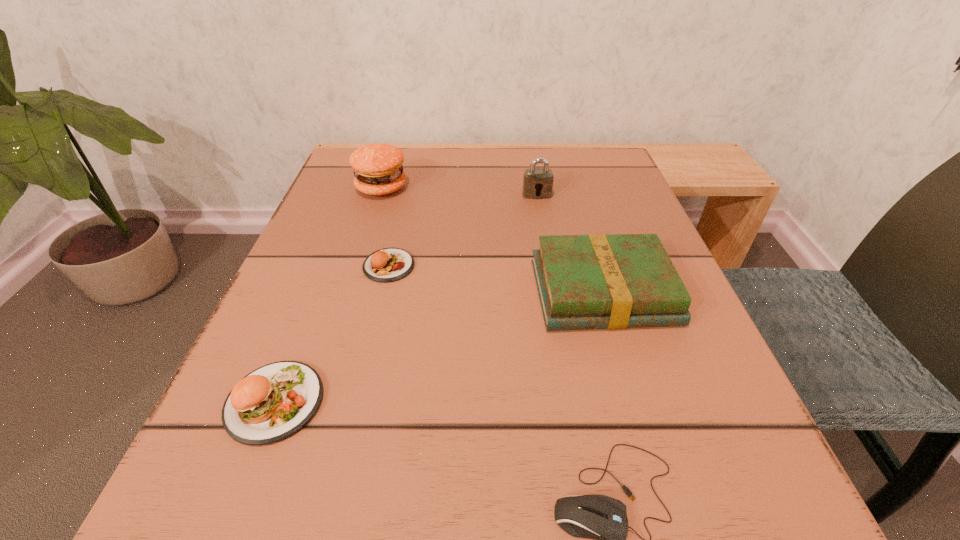
Where is `the farthest patty (food)`? Image resolution: width=960 pixels, height=540 pixels. the farthest patty (food) is located at coordinates (378, 170).

This screenshot has width=960, height=540. In order to click on padlock in this screenshot , I will do `click(536, 181)`.

Identify the location of the fourth shortest object. The height and width of the screenshot is (540, 960). (596, 281).

Find the location of a particular element. The height and width of the screenshot is (540, 960). the fourth tallest object is located at coordinates (271, 403).

You are a GUI agent. You are given a task and a screenshot of the screen. Output one action in this format:
    pyautogui.click(x=<x>, y=<y>)
    Task: Click on the second shortest patty (food)
    
    Given the screenshot: What is the action you would take?
    pyautogui.click(x=271, y=403)

Identify the location of the shortest patty (food). The width and height of the screenshot is (960, 540). (388, 264).

I want to click on free space located on the right of the tallest patty (food), so click(x=450, y=187).

You are a GUI agent. You are given a task and a screenshot of the screen. Output one action in this format:
    pyautogui.click(x=<x>, y=<y>)
    Task: Click on the blank space located at the front of the padlock near the keyhole
    The image size is (960, 540).
    Given the screenshot: What is the action you would take?
    pyautogui.click(x=550, y=268)

Find the location of a particular element. The height and width of the screenshot is (540, 960). vacant point located on the left of the fourth shortest object is located at coordinates (381, 292).

At what (x,y) coordinates should I click in order to perform the action: click on vacant space located on the right of the fourth tallest object. Please return your answer as a coordinate pair (x, y). Looking at the image, I should click on (476, 402).